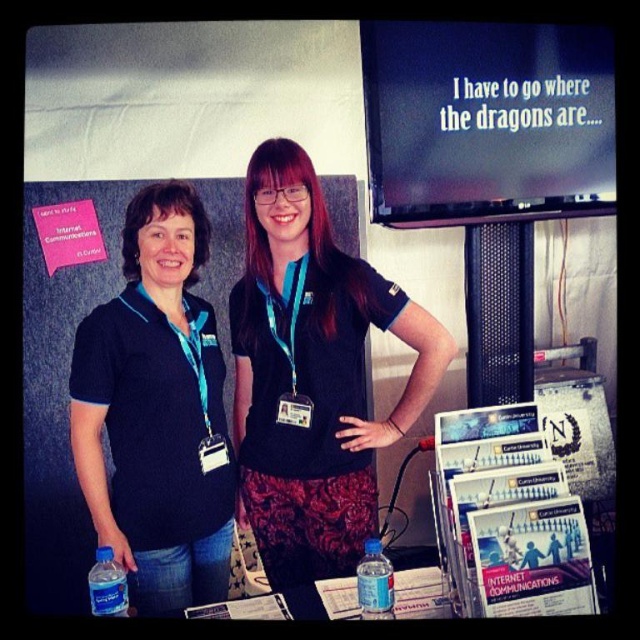
You are trying to determine if the matte black shirt at center can completely cover the teal fabric lanyard at center when viewed from the front. Based on their positions and sizes, is this possible?

The matte black shirt at center might be wider than teal fabric lanyard at center, so it is possible that the matte black shirt at center could cover the teal fabric lanyard at center when viewed from the front, depending on their exact positions and angles.

Looking at this image, you are trying to determine which object is higher in the image. You see the matte black shirt at center and the teal fabric lanyard at center. Which one is taller?

The matte black shirt at center is much taller as the teal fabric lanyard at center.

You are a photographer at the event and need to take a clear photo of both the matte black shirt at left and the blue plastic water bottle at lower center. Which object should you focus on first to ensure both are in focus?

You should focus on the matte black shirt at left first because it is closer to you than the blue plastic water bottle at lower center. By focusing on the closer object, the depth of field may also keep the farther object in focus.